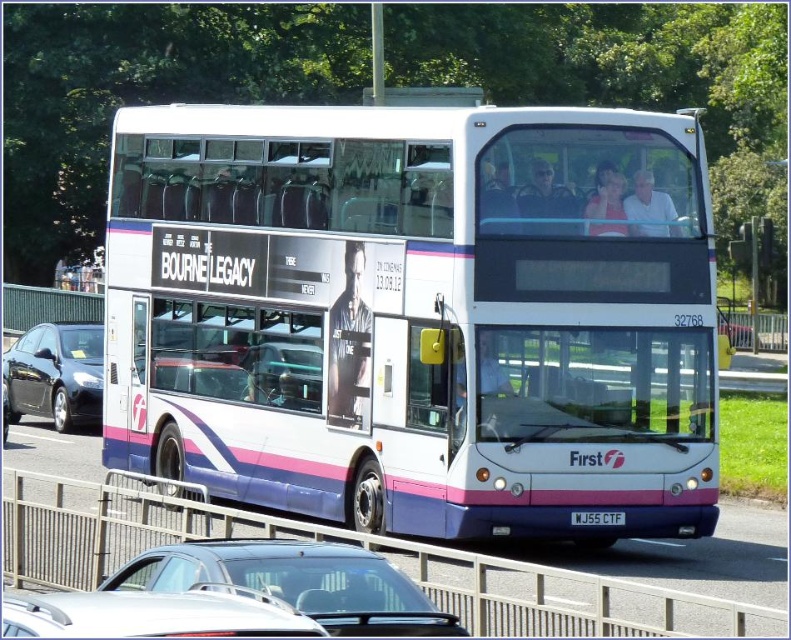
Is point (14, 360) positioned after point (577, 520)?

That is True.

Does shiny black sedan at left have a lesser width compared to white plastic license plate at center?

No, shiny black sedan at left is not thinner than white plastic license plate at center.

At what (x,y) coordinates should I click in order to perform the action: click on shiny black sedan at left. Please return your answer as a coordinate pair (x, y). Looking at the image, I should click on (55, 374).

Where is `shiny black sedan at left`? shiny black sedan at left is located at coordinates (55, 374).

Is the position of silver metallic car at center more distant than that of shiny black sedan at left?

No, silver metallic car at center is closer to the viewer.

Does silver metallic car at center have a greater width compared to shiny black sedan at left?

Incorrect, silver metallic car at center's width does not surpass shiny black sedan at left's.

What do you see at coordinates (294, 582) in the screenshot? Image resolution: width=791 pixels, height=640 pixels. I see `silver metallic car at center` at bounding box center [294, 582].

In order to click on silver metallic car at center in this screenshot , I will do `click(294, 582)`.

Who is higher up, silver metallic car at center or white plastic license plate at center?

silver metallic car at center is higher up.

Is point (271, 579) less distant than point (573, 524)?

Yes, point (271, 579) is closer to viewer.

This screenshot has width=791, height=640. What are the coordinates of `silver metallic car at center` in the screenshot? It's located at (294, 582).